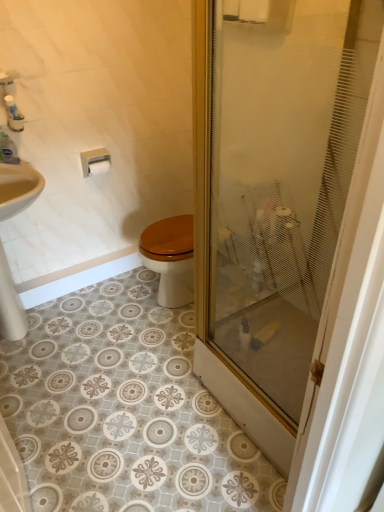
Question: From the image's perspective, is clear plastic bottle at upper left located above transparent frosted glass at center?

Choices:
 (A) yes
 (B) no

Answer: (A)

Question: Is clear plastic bottle at upper left beside transparent frosted glass at center?

Choices:
 (A) no
 (B) yes

Answer: (A)

Question: Does clear plastic bottle at upper left lie in front of transparent frosted glass at center?

Choices:
 (A) no
 (B) yes

Answer: (A)

Question: Is transparent frosted glass at center located within clear plastic bottle at upper left?

Choices:
 (A) no
 (B) yes

Answer: (A)

Question: Does clear plastic bottle at upper left appear on the right side of transparent frosted glass at center?

Choices:
 (A) no
 (B) yes

Answer: (A)

Question: Is transparent frosted glass at center at the back of clear plastic bottle at upper left?

Choices:
 (A) yes
 (B) no

Answer: (B)

Question: From a real-world perspective, is transparent frosted glass at center beneath clear plastic bottle at upper left?

Choices:
 (A) yes
 (B) no

Answer: (A)

Question: Is transparent frosted glass at center positioned before clear plastic bottle at upper left?

Choices:
 (A) no
 (B) yes

Answer: (B)

Question: Is transparent frosted glass at center looking in the opposite direction of clear plastic bottle at upper left?

Choices:
 (A) yes
 (B) no

Answer: (B)

Question: Does transparent frosted glass at center have a lesser width compared to clear plastic bottle at upper left?

Choices:
 (A) yes
 (B) no

Answer: (B)

Question: Is transparent frosted glass at center bigger than clear plastic bottle at upper left?

Choices:
 (A) no
 (B) yes

Answer: (B)

Question: Considering the relative positions of transparent frosted glass at center and clear plastic bottle at upper left in the image provided, is transparent frosted glass at center to the left of clear plastic bottle at upper left from the viewer's perspective?

Choices:
 (A) no
 (B) yes

Answer: (A)

Question: Is white matte toilet paper at upper left not inside white plastic toilet paper holder at upper left?

Choices:
 (A) yes
 (B) no

Answer: (B)